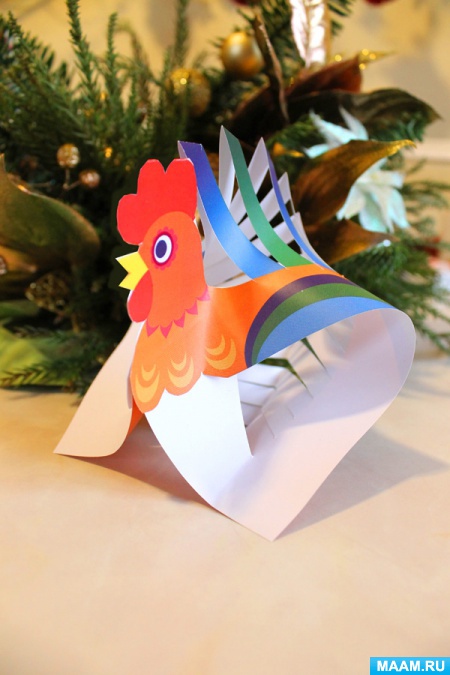
The image size is (450, 675). Find the location of `ornament`. ornament is located at coordinates (194, 82), (247, 55), (66, 157), (85, 181).